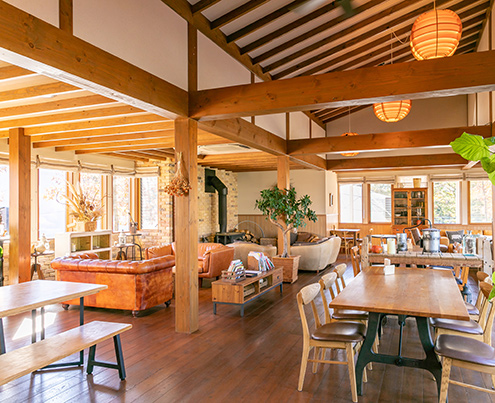
Image resolution: width=495 pixels, height=403 pixels. What are the coordinates of `ball ceiling lights` in the screenshot? It's located at (399, 109), (446, 31), (347, 154).